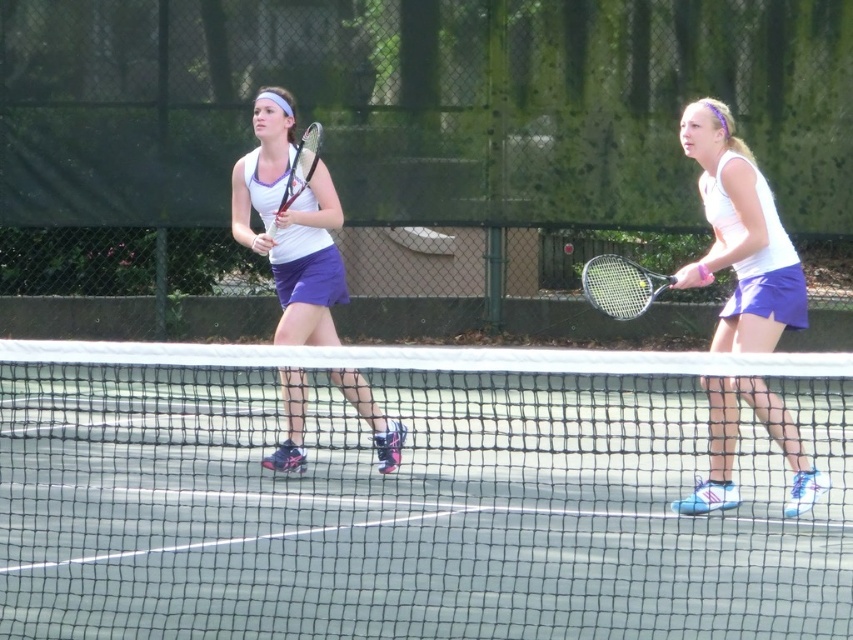
You are a tennis coach observing a doubles match. You notice two rackets in the scene. Which racket is shorter in length between the black matte tennis racket at right and the white matte tennis racket at center?

The black matte tennis racket at right is shorter than the white matte tennis racket at center.

You are a tennis player preparing to hit a ball over the white mesh net at center. You have a white matte tennis racket at right in your hand. Can you safely clear the net with your swing?

The white mesh net at center is shorter than the white matte tennis racket at right, so if you swing the racket at its full height, you might hit the net. Adjust your swing to ensure the racket clears the net properly.

You are a tennis ball currently traveling towards the black matte tennis racket at right and the white matte tennis racket at center. Which racket will you hit first?

The black matte tennis racket at right is 2.47 meters away from the white matte tennis racket at center. Since you are traveling towards both, the distance between them doesn t determine which you hit first. Your trajectory and direction would determine that, but based on the given information, it s impossible to say.